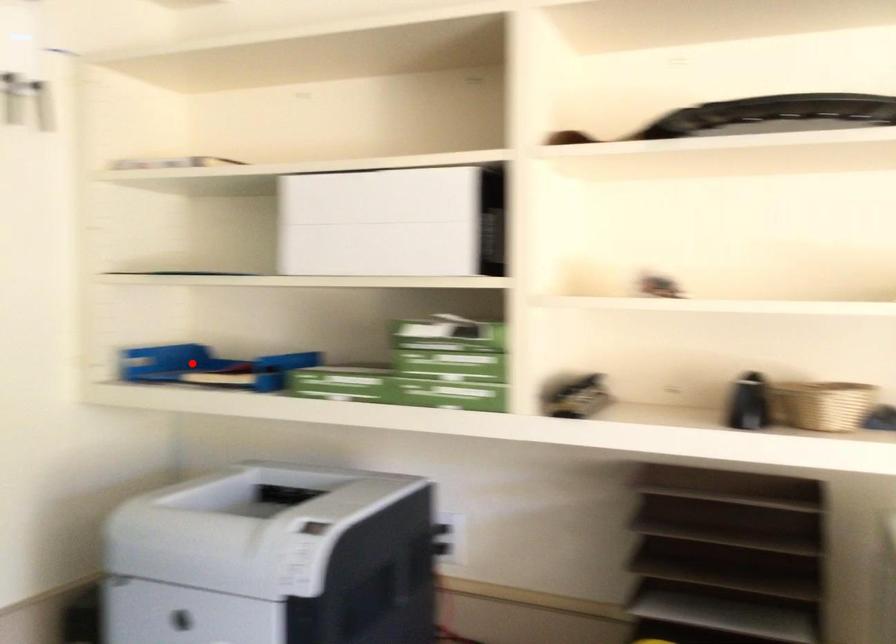
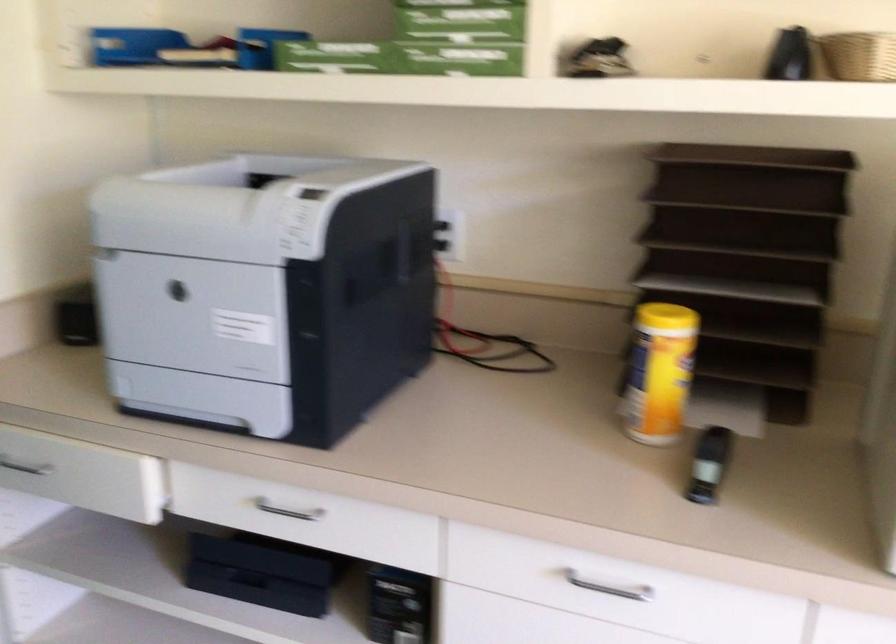
Question: A red point is marked in image1. In image2, is the corresponding 3D point closer to the camera or farther? Reply with the corresponding letter.

Choices:
 (A) The corresponding 3D point is closer.
 (B) The corresponding 3D point is farther.

Answer: (A)